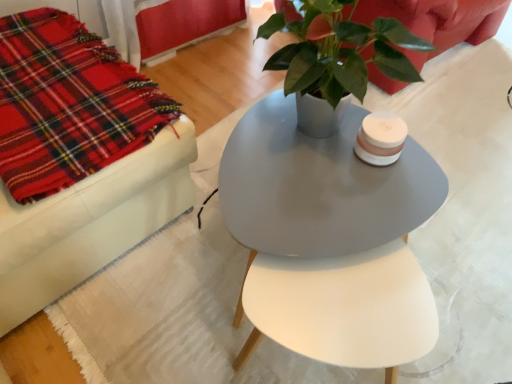
Question: Considering the relative sizes of red plaid fabric at left and matte gray table at center in the image provided, is red plaid fabric at left thinner than matte gray table at center?

Choices:
 (A) yes
 (B) no

Answer: (A)

Question: Are red plaid fabric at left and matte gray table at center located far from each other?

Choices:
 (A) no
 (B) yes

Answer: (A)

Question: Does red plaid fabric at left have a lesser height compared to matte gray table at center?

Choices:
 (A) yes
 (B) no

Answer: (A)

Question: From a real-world perspective, is red plaid fabric at left located beneath matte gray table at center?

Choices:
 (A) no
 (B) yes

Answer: (A)

Question: Is red plaid fabric at left at the left side of matte gray table at center?

Choices:
 (A) yes
 (B) no

Answer: (A)

Question: Could you tell me if red plaid fabric at left is turned towards matte gray table at center?

Choices:
 (A) no
 (B) yes

Answer: (A)

Question: Does matte red couch at upper left have a lesser height compared to matte gray table at center?

Choices:
 (A) yes
 (B) no

Answer: (B)

Question: Would you say matte red couch at upper left is outside matte gray table at center?

Choices:
 (A) no
 (B) yes

Answer: (B)

Question: Does matte red couch at upper left turn towards matte gray table at center?

Choices:
 (A) yes
 (B) no

Answer: (B)

Question: Does matte red couch at upper left contain matte gray table at center?

Choices:
 (A) yes
 (B) no

Answer: (B)

Question: Is matte red couch at upper left closer to camera compared to matte gray table at center?

Choices:
 (A) yes
 (B) no

Answer: (B)

Question: Is matte red couch at upper left positioned with its back to matte gray table at center?

Choices:
 (A) yes
 (B) no

Answer: (B)

Question: Is matte gray table at center not within matte red couch at upper left?

Choices:
 (A) no
 (B) yes

Answer: (B)